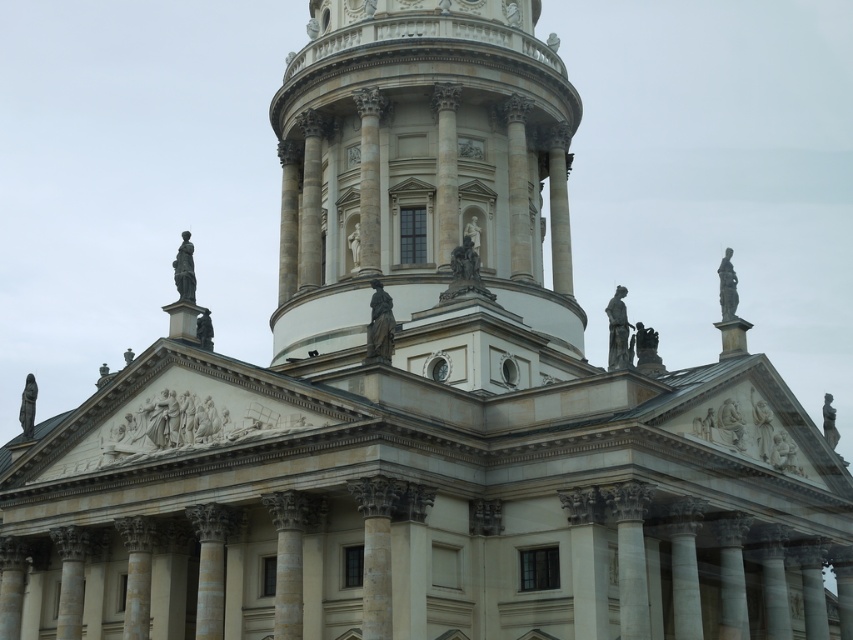
Question: Which point is closer to the camera?

Choices:
 (A) white marble statue at lower right
 (B) polished bronze statue at center

Answer: (A)

Question: Which is farther from the dark gray stone statue at center?

Choices:
 (A) polished bronze statue at center
 (B) matte gray statue at upper left
 (C) polished bronze statue at upper right

Answer: (C)

Question: Is polished bronze statue at center to the left of matte bronze statue at upper center from the viewer's perspective?

Choices:
 (A) yes
 (B) no

Answer: (A)

Question: Is white marble statue at center positioned before matte bronze statue at upper center?

Choices:
 (A) yes
 (B) no

Answer: (A)

Question: Does white stone tower at center appear on the left side of white marble statue at lower right?

Choices:
 (A) no
 (B) yes

Answer: (B)

Question: Based on their relative distances, which object is nearer to the gray stone statue at center?

Choices:
 (A) polished bronze statue at center
 (B) gray stone statue at left
 (C) white stone tower at center
 (D) dark gray stone statue at center

Answer: (A)